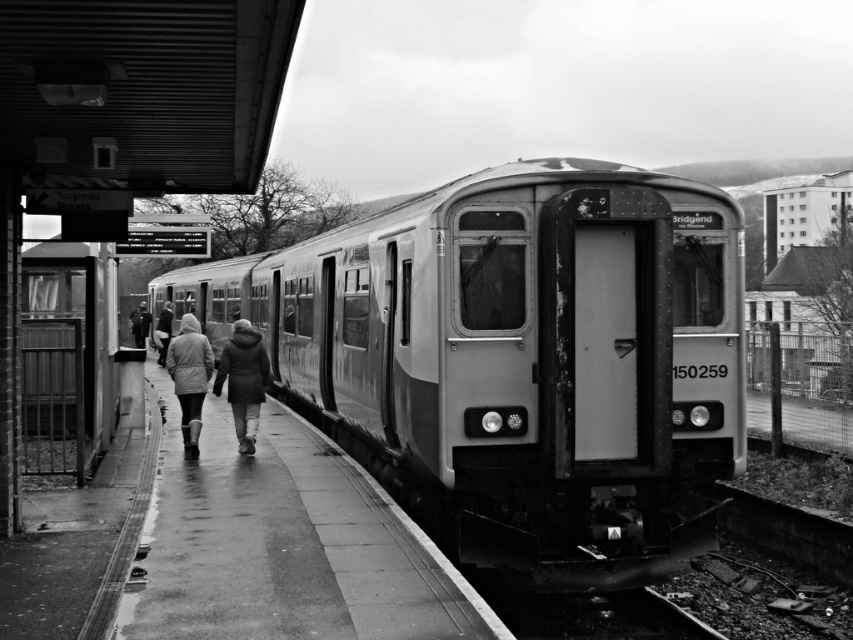
Question: Does concrete platform at center appear on the left side of matte gray coat at center?

Choices:
 (A) yes
 (B) no

Answer: (B)

Question: Which object is positioned farthest from the concrete platform at center?

Choices:
 (A) dark gray jacket at center
 (B) metallic gray train at center

Answer: (B)

Question: Which point is closer to the camera taking this photo?

Choices:
 (A) pos(206,358)
 (B) pos(170,326)

Answer: (A)

Question: Does metallic gray train at center come in front of dark gray coat at center?

Choices:
 (A) no
 (B) yes

Answer: (B)

Question: Observing the image, what is the correct spatial positioning of concrete platform at center in reference to dark gray coat at center?

Choices:
 (A) below
 (B) above

Answer: (A)

Question: Which object appears closest to the camera in this image?

Choices:
 (A) dark gray jacket at center
 (B) matte gray coat at center
 (C) metallic gray train at center
 (D) dark gray coat at center

Answer: (C)